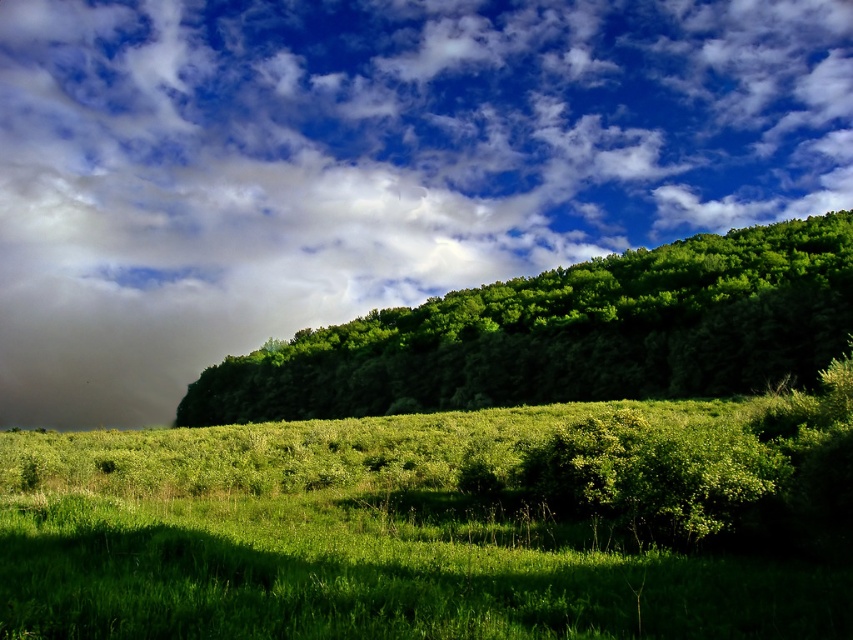
Which is in front, point (144, 156) or point (801, 241)?

Positioned in front is point (801, 241).

Which is more to the right, dark gray cloud at upper left or green leafy tree at upper center?

green leafy tree at upper center is more to the right.

Which is in front, point (433, 282) or point (717, 307)?

Point (717, 307)

Where is `dark gray cloud at upper left`? This screenshot has width=853, height=640. dark gray cloud at upper left is located at coordinates (368, 164).